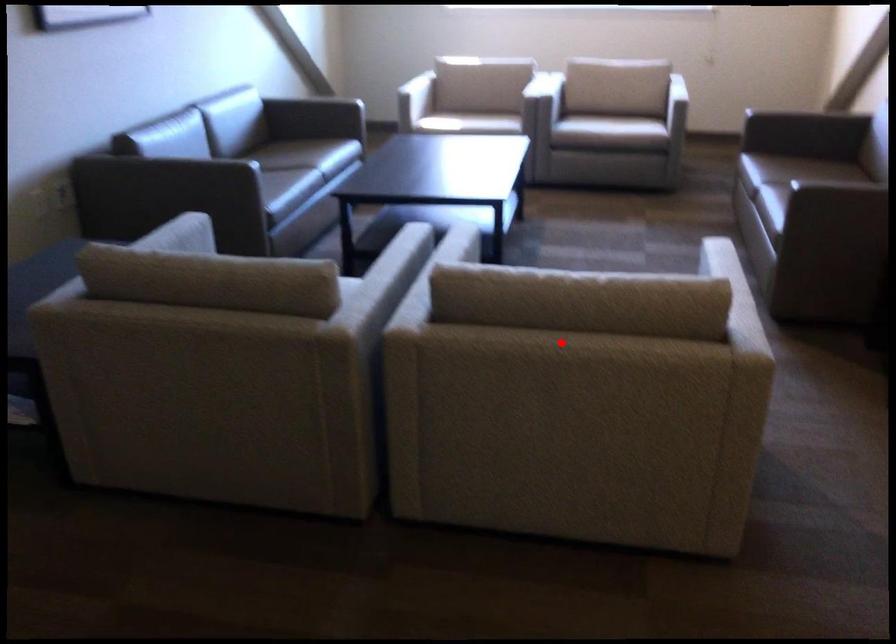
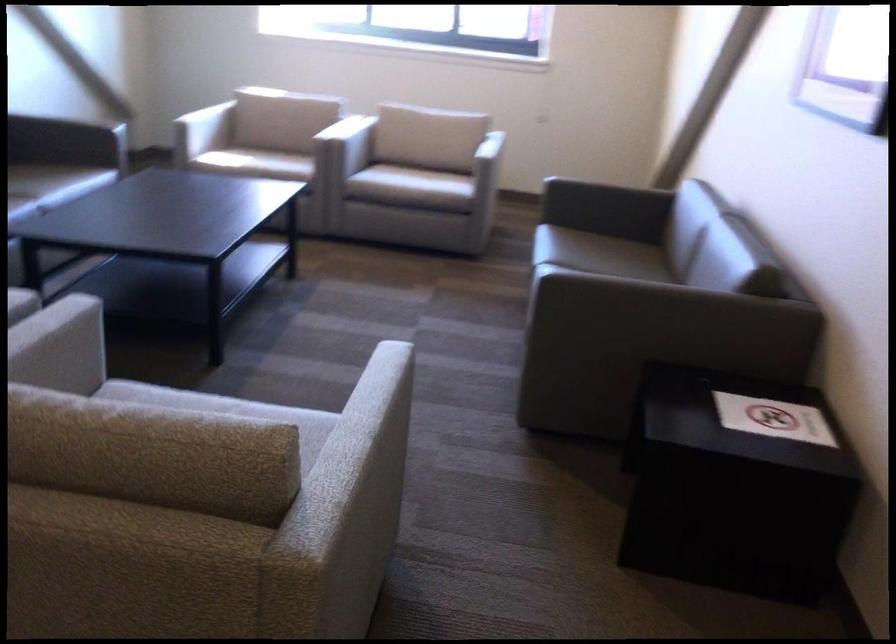
Question: I am providing you with two images of the same scene from different viewpoints. Image1 has a red point marked. In image2, the corresponding 3D location appears at what relative position? Reply with the corresponding letter.

Choices:
 (A) Closer
 (B) Farther

Answer: (A)